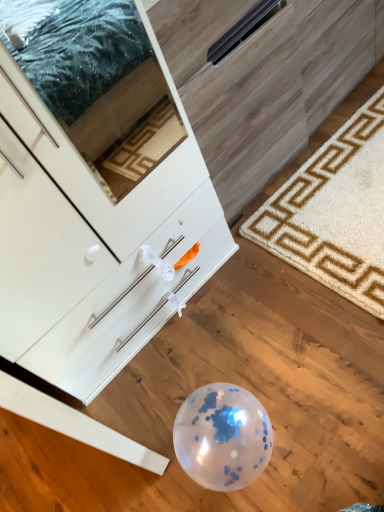
This screenshot has height=512, width=384. Identify the location of white textured rug at lower right. (334, 212).

This screenshot has height=512, width=384. What do you see at coordinates (334, 212) in the screenshot? I see `white textured rug at lower right` at bounding box center [334, 212].

This screenshot has height=512, width=384. I want to click on white glossy cabinet at lower left, so click(x=93, y=207).

What do you see at coordinates (93, 207) in the screenshot? This screenshot has height=512, width=384. I see `white glossy cabinet at lower left` at bounding box center [93, 207].

At what (x,y) coordinates should I click in order to perform the action: click on white textured rug at lower right. Please return your answer as a coordinate pair (x, y). Looking at the image, I should click on (334, 212).

Is white glossy cabinet at lower left to the left of white textured rug at lower right from the viewer's perspective?

Yes.

In the image, is white glossy cabinet at lower left positioned in front of or behind white textured rug at lower right?

white glossy cabinet at lower left is in front of white textured rug at lower right.

Is point (157, 199) closer or farther from the camera than point (337, 207)?

Clearly, point (157, 199) is closer to the camera than point (337, 207).

From the image's perspective, which is above, white glossy cabinet at lower left or white textured rug at lower right?

white textured rug at lower right.

From a real-world perspective, is white glossy cabinet at lower left above or below white textured rug at lower right?

In terms of real-world spatial position, white glossy cabinet at lower left is below white textured rug at lower right.

Does white glossy cabinet at lower left have a greater width compared to white textured rug at lower right?

Indeed, white glossy cabinet at lower left has a greater width compared to white textured rug at lower right.

Who is shorter, white glossy cabinet at lower left or white textured rug at lower right?

white textured rug at lower right is shorter.

Does white glossy cabinet at lower left have a smaller size compared to white textured rug at lower right?

Actually, white glossy cabinet at lower left might be larger than white textured rug at lower right.

Is white textured rug at lower right surrounded by white glossy cabinet at lower left?

Indeed, white textured rug at lower right is located within white glossy cabinet at lower left.

Would you consider white glossy cabinet at lower left to be distant from white textured rug at lower right?

No.

Could you tell me if white glossy cabinet at lower left is turned towards white textured rug at lower right?

Yes, white glossy cabinet at lower left is facing white textured rug at lower right.

Can you tell me how much white glossy cabinet at lower left and white textured rug at lower right differ in facing direction?

white glossy cabinet at lower left and white textured rug at lower right are facing 178 degrees away from each other.

Where is `mat on the right side of white glossy cabinet at lower left`? mat on the right side of white glossy cabinet at lower left is located at coordinates (334, 212).

Based on the photo, considering the positions of objects white textured rug at lower right and white glossy cabinet at lower left in the image provided, who is more to the left, white textured rug at lower right or white glossy cabinet at lower left?

From the viewer's perspective, white glossy cabinet at lower left appears more on the left side.

Which is in front, white textured rug at lower right or white glossy cabinet at lower left?

white glossy cabinet at lower left is in front.

Which is farther, (x=326, y=215) or (x=97, y=68)?

The point (x=97, y=68) is behind.

From the image's perspective, which is above, white textured rug at lower right or white glossy cabinet at lower left?

white textured rug at lower right.

From a real-world perspective, which object rests below the other?

white glossy cabinet at lower left.

Which object is wider, white textured rug at lower right or white glossy cabinet at lower left?

white glossy cabinet at lower left.

Consider the image. Is white textured rug at lower right shorter than white glossy cabinet at lower left?

Indeed, white textured rug at lower right has a lesser height compared to white glossy cabinet at lower left.

Between white textured rug at lower right and white glossy cabinet at lower left, which one has smaller size?

With smaller size is white textured rug at lower right.

Is white textured rug at lower right not within white glossy cabinet at lower left?

No, white textured rug at lower right is not outside of white glossy cabinet at lower left.

Is white textured rug at lower right far from white glossy cabinet at lower left?

They are positioned close to each other.

Does white textured rug at lower right turn towards white glossy cabinet at lower left?

Yes, white textured rug at lower right is aimed at white glossy cabinet at lower left.

In the scene shown: How different are the orientations of white textured rug at lower right and white glossy cabinet at lower left in degrees?

They differ by 178 degrees in their facing directions.

How much distance is there between white textured rug at lower right and white glossy cabinet at lower left?

18.71 inches.

Where is `mat above the white glossy cabinet at lower left (from a real-world perspective)`? The height and width of the screenshot is (512, 384). mat above the white glossy cabinet at lower left (from a real-world perspective) is located at coordinates (334, 212).

At what (x,y) coordinates should I click in order to perform the action: click on chest of drawers that is on the left side of white textured rug at lower right. Please return your answer as a coordinate pair (x, y). Looking at the image, I should click on (93, 207).

Locate an element on the screen. the chest of drawers that is below the white textured rug at lower right (from the image's perspective) is located at coordinates (93, 207).